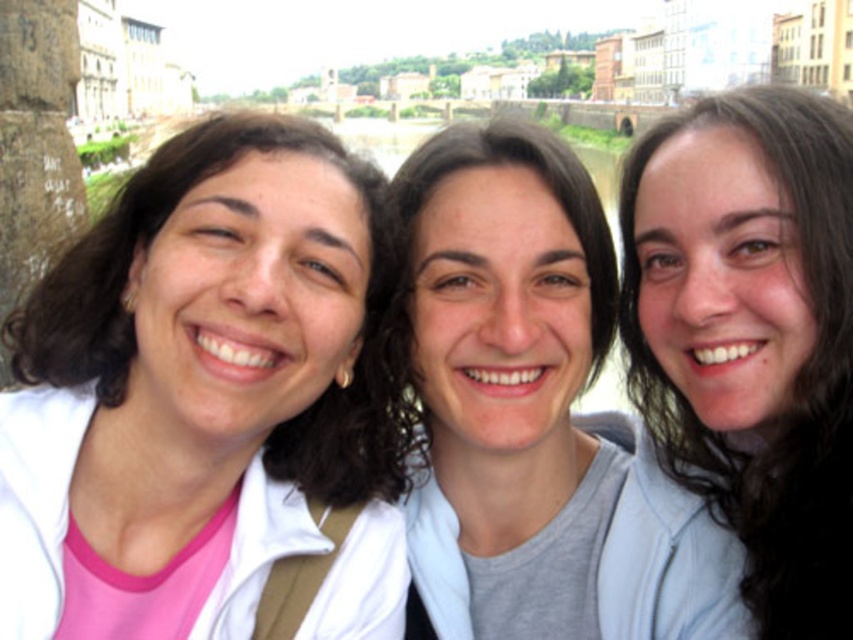
Question: Which of the following is the closest to the observer?

Choices:
 (A) white matte jacket at left
 (B) dark brown hair at center
 (C) matte white shirt at center

Answer: (A)

Question: Which point is closer to the camera?

Choices:
 (A) (811, 170)
 (B) (476, 593)

Answer: (A)

Question: Can you confirm if matte white shirt at center is smaller than dark brown hair at center?

Choices:
 (A) no
 (B) yes

Answer: (A)

Question: Can you confirm if white matte jacket at left is positioned to the right of dark brown hair at center?

Choices:
 (A) no
 (B) yes

Answer: (A)

Question: Observing the image, what is the correct spatial positioning of white matte jacket at left in reference to matte white shirt at center?

Choices:
 (A) right
 (B) left

Answer: (B)

Question: Based on their relative distances, which object is nearer to the white matte jacket at left?

Choices:
 (A) matte white shirt at center
 (B) dark brown hair at center

Answer: (A)